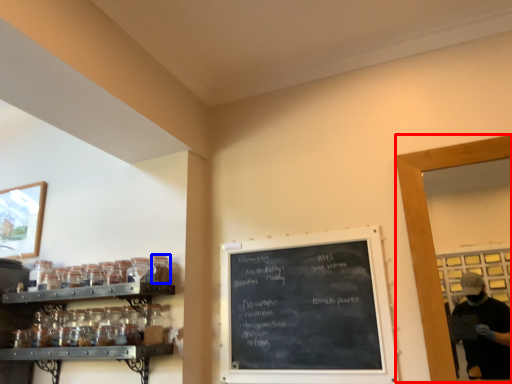
Question: Which object appears closest to the camera in this image, glass door (highlighted by a red box) or glass jar (highlighted by a blue box)?

Choices:
 (A) glass door
 (B) glass jar

Answer: (A)